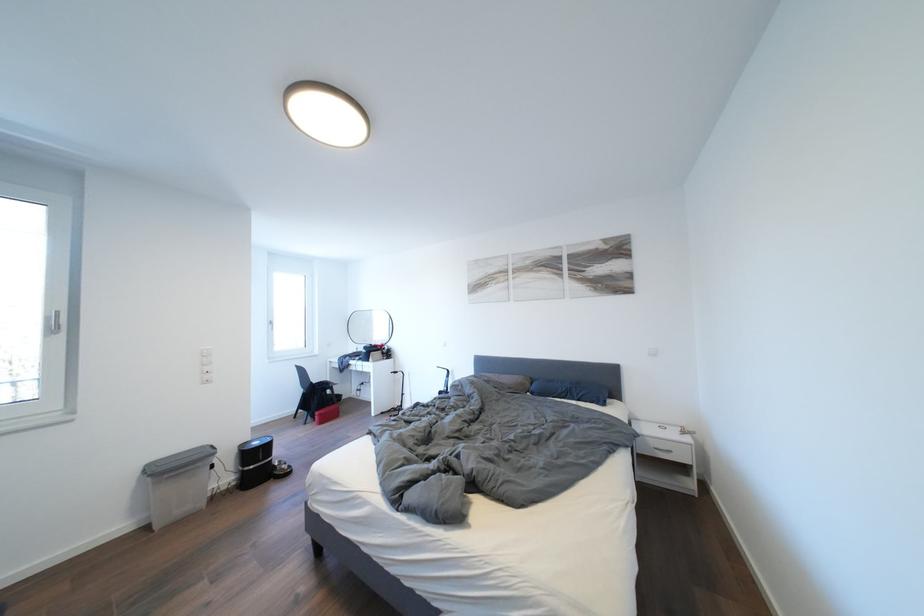
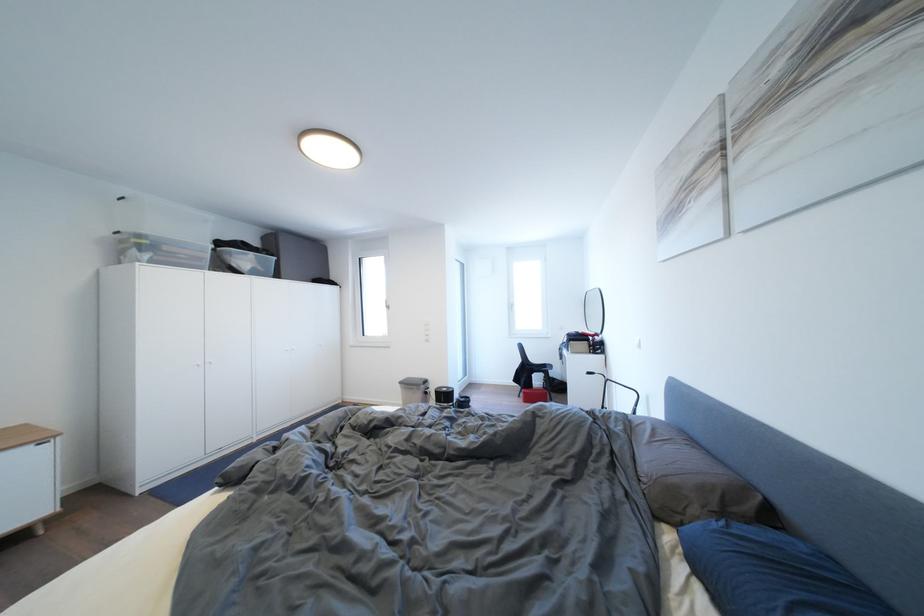
Where in the second image is the point corresponding to (329,419) from the first image?

(532, 398)